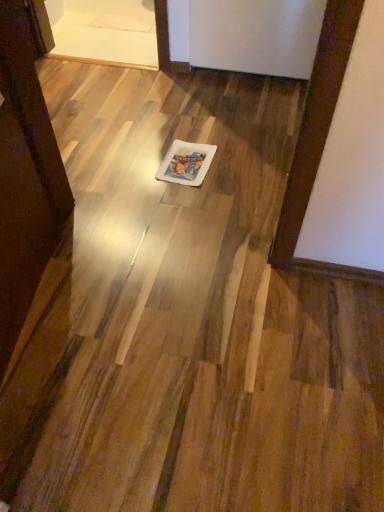
Question: Should I look upward or downward to see white glossy square plate at center?

Choices:
 (A) up
 (B) down

Answer: (A)